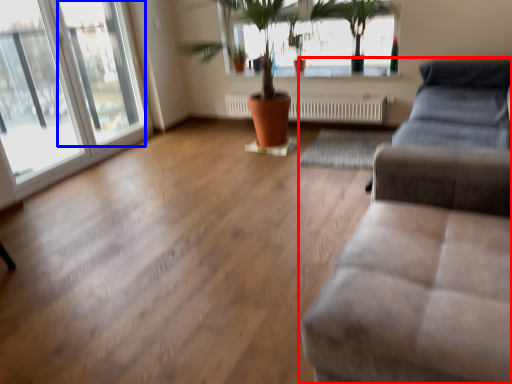
Question: Which object is closer to the camera taking this photo, studio couch (highlighted by a red box) or window (highlighted by a blue box)?

Choices:
 (A) studio couch
 (B) window

Answer: (A)